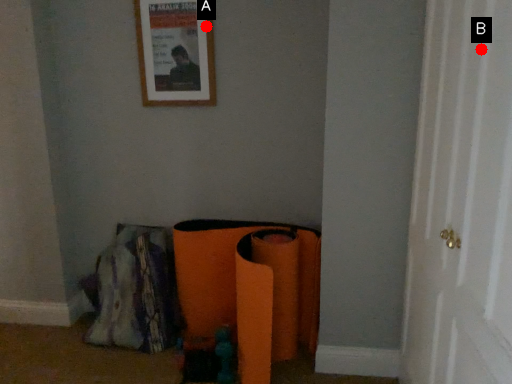
Question: Two points are circled on the image, labeled by A and B beside each circle. Which point appears closest to the camera in this image?

Choices:
 (A) A is closer
 (B) B is closer

Answer: (B)